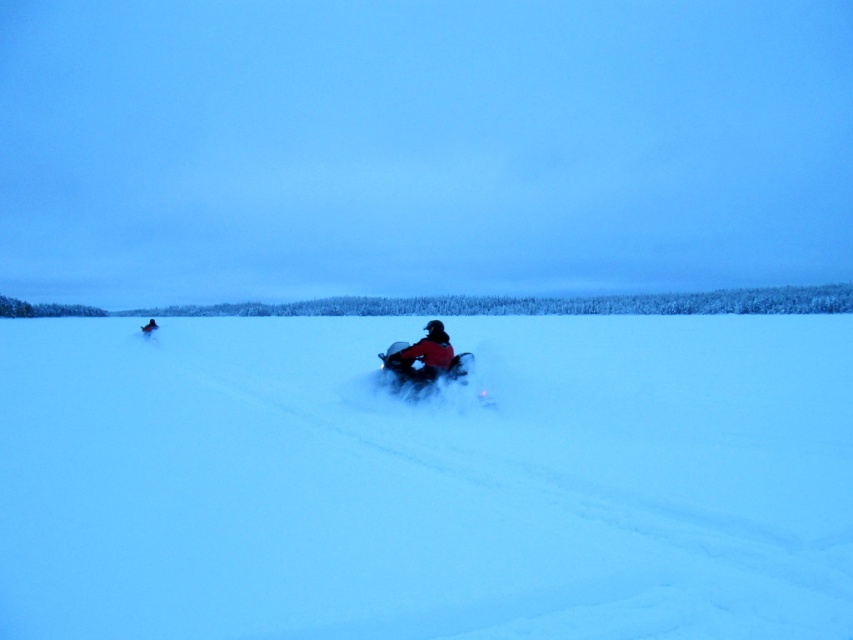
Question: Based on their relative distances, which object is nearer to the red matte snowmobile at center?

Choices:
 (A) shiny metallic snowmobile at center
 (B) white powdery snow at center

Answer: (A)

Question: Is shiny metallic snowmobile at center thinner than red matte snowmobile at center?

Choices:
 (A) yes
 (B) no

Answer: (B)

Question: Can you confirm if white powdery snow at center is positioned to the left of red matte snowmobile at center?

Choices:
 (A) yes
 (B) no

Answer: (B)

Question: Which point is closer to the camera?

Choices:
 (A) red matte snowmobile at center
 (B) shiny metallic snowmobile at center
 (C) white powdery snow at center

Answer: (C)

Question: Which object appears farthest from the camera in this image?

Choices:
 (A) shiny metallic snowmobile at center
 (B) white powdery snow at center
 (C) red matte snowmobile at center

Answer: (C)

Question: Does white powdery snow at center have a lesser width compared to red matte snowmobile at center?

Choices:
 (A) no
 (B) yes

Answer: (A)